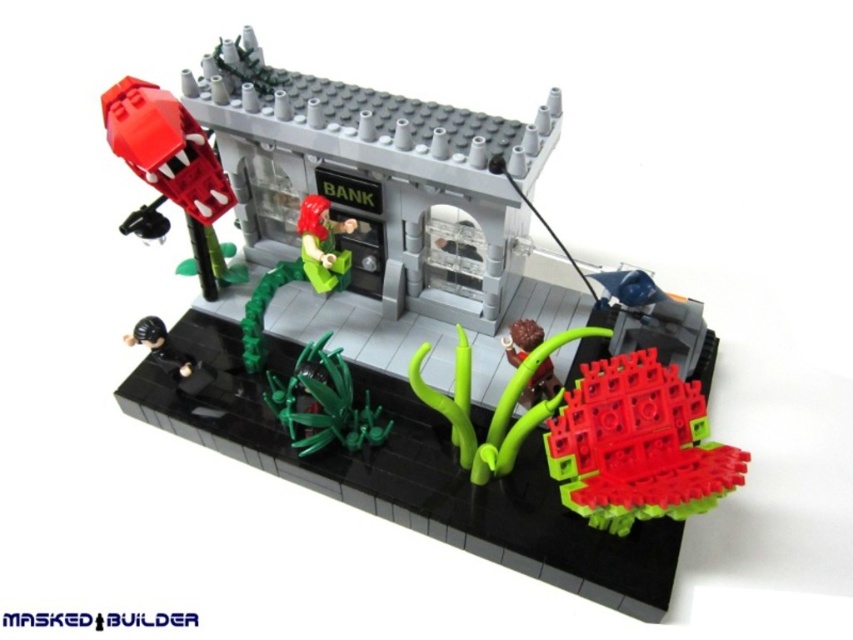
You are a visitor looking at the LEGO diorama. You notice two plants in the scene. Which one is positioned closer to you, the translucent red plastic plant at lower right or the green matte plant at center?

The translucent red plastic plant at lower right is closer to the viewer than the green matte plant at center.

You are a delivery drone with a 50 cm wingspan. You need to fly from the translucent red plastic plant at lower right to the green matte figure at center in the LEGO diorama. Can you safely navigate the space between them without hitting anything?

The distance between the translucent red plastic plant at lower right and the green matte figure at center is 49.24 centimeters. Since your wingspan is 50 cm, you cannot safely navigate the space between them without risking a collision.